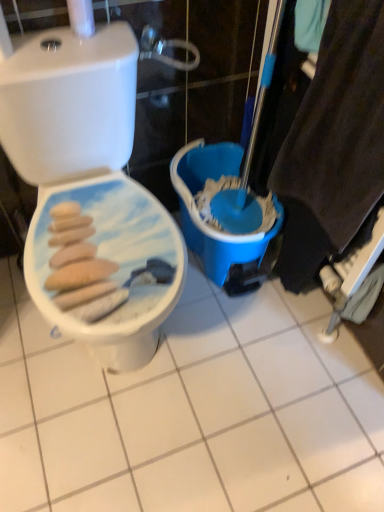
Question: Is white glossy ceramic tile at center at the left side of blue plastic bucket at center?

Choices:
 (A) yes
 (B) no

Answer: (A)

Question: Would you consider white glossy ceramic tile at center to be distant from blue plastic bucket at center?

Choices:
 (A) no
 (B) yes

Answer: (A)

Question: Is the surface of white glossy ceramic tile at center in direct contact with blue plastic bucket at center?

Choices:
 (A) yes
 (B) no

Answer: (B)

Question: Can you confirm if white glossy ceramic tile at center is taller than blue plastic bucket at center?

Choices:
 (A) yes
 (B) no

Answer: (B)

Question: Is white glossy ceramic tile at center to the right of blue plastic bucket at center from the viewer's perspective?

Choices:
 (A) yes
 (B) no

Answer: (B)

Question: Does white glossy ceramic tile at center have a greater width compared to blue plastic bucket at center?

Choices:
 (A) yes
 (B) no

Answer: (A)

Question: Is blue plastic bucket at center positioned in front of white glossy toilet seat at left?

Choices:
 (A) no
 (B) yes

Answer: (A)

Question: Is blue plastic bucket at center oriented towards white glossy toilet seat at left?

Choices:
 (A) no
 (B) yes

Answer: (B)

Question: Is blue plastic bucket at center far away from white glossy toilet seat at left?

Choices:
 (A) no
 (B) yes

Answer: (A)

Question: Is blue plastic bucket at center bigger than white glossy toilet seat at left?

Choices:
 (A) no
 (B) yes

Answer: (A)

Question: Can you confirm if blue plastic bucket at center is positioned to the left of white glossy toilet seat at left?

Choices:
 (A) yes
 (B) no

Answer: (B)

Question: From the image's perspective, is blue plastic bucket at center beneath white glossy toilet seat at left?

Choices:
 (A) yes
 (B) no

Answer: (B)

Question: Can you confirm if blue plastic bucket at center is wider than white glossy ceramic tile at center?

Choices:
 (A) no
 (B) yes

Answer: (A)